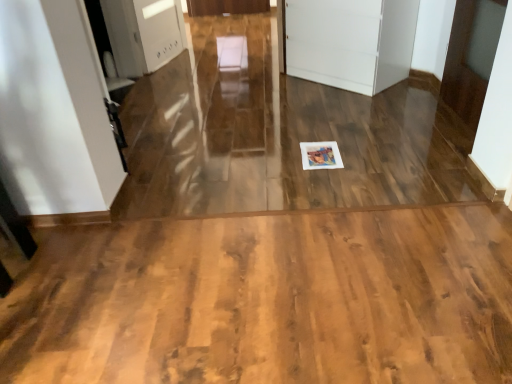
Question: Does wooden floor at center have a lesser height compared to white glossy door at upper right, which is counted as the 1th door, starting from the right?

Choices:
 (A) yes
 (B) no

Answer: (A)

Question: Is wooden floor at center taller than white glossy door at upper right, which is counted as the 1th door, starting from the right?

Choices:
 (A) no
 (B) yes

Answer: (A)

Question: From the image's perspective, is wooden floor at center below white glossy door at upper right, which is counted as the 1th door, starting from the right?

Choices:
 (A) yes
 (B) no

Answer: (A)

Question: Is wooden floor at center to the left of white glossy door at upper right, which ranks as the 2th door in left-to-right order, from the viewer's perspective?

Choices:
 (A) no
 (B) yes

Answer: (B)

Question: Is wooden floor at center positioned beyond the bounds of white glossy door at upper right, which ranks as the 2th door in left-to-right order?

Choices:
 (A) no
 (B) yes

Answer: (B)

Question: Is wooden floor at center wider or thinner than white glossy door at upper right, which ranks as the 2th door in left-to-right order?

Choices:
 (A) thin
 (B) wide

Answer: (B)

Question: Looking at the image, does wooden floor at center seem bigger or smaller compared to white glossy door at upper right, which is counted as the 1th door, starting from the right?

Choices:
 (A) small
 (B) big

Answer: (B)

Question: From their relative heights in the image, would you say wooden floor at center is taller or shorter than white glossy door at upper right, which ranks as the 2th door in left-to-right order?

Choices:
 (A) short
 (B) tall

Answer: (A)

Question: Is point (323, 309) positioned closer to the camera than point (458, 36)?

Choices:
 (A) closer
 (B) farther

Answer: (A)

Question: From the image's perspective, relative to wooden floor at center, is white matte cabinet at center, acting as the first door starting from the left, above or below?

Choices:
 (A) above
 (B) below

Answer: (A)

Question: Is white matte cabinet at center, which is the 2th door from right to left, bigger or smaller than wooden floor at center?

Choices:
 (A) big
 (B) small

Answer: (A)

Question: Based on their positions, is white matte cabinet at center, which is the 2th door from right to left, located to the left or right of wooden floor at center?

Choices:
 (A) left
 (B) right

Answer: (B)

Question: Does point (387, 67) appear closer or farther from the camera than point (129, 256)?

Choices:
 (A) farther
 (B) closer

Answer: (A)

Question: Does point (454, 76) appear closer or farther from the camera than point (396, 74)?

Choices:
 (A) closer
 (B) farther

Answer: (A)

Question: In terms of size, does white glossy door at upper right, which ranks as the 2th door in left-to-right order, appear bigger or smaller than white matte cabinet at center, which is the 2th door from right to left?

Choices:
 (A) small
 (B) big

Answer: (A)